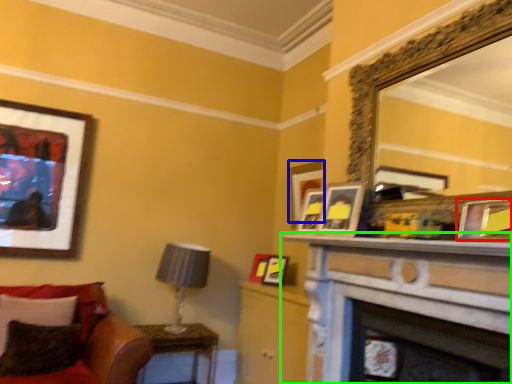
Question: Considering the real-world distances, which object is closest to picture frame (highlighted by a red box)? picture frame (highlighted by a blue box) or shelf (highlighted by a green box).

Choices:
 (A) picture frame
 (B) shelf

Answer: (B)